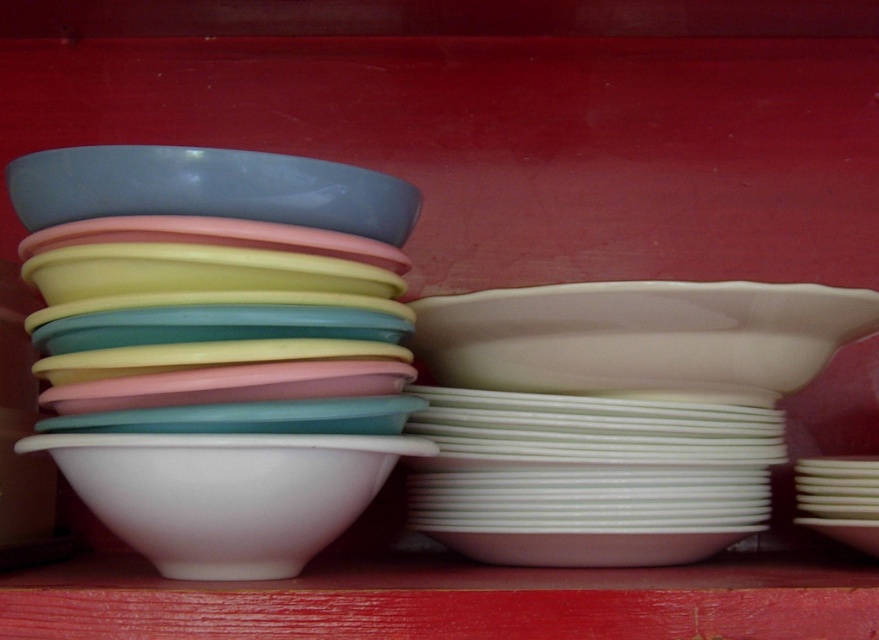
You are organizing dishes on a shelf and see the white glossy bowl at right and the white glossy bowl at center. Which bowl is closer to you?

The white glossy bowl at right is closer to you because the white glossy bowl at center is behind it.

You are a delivery person standing in front of the red wooden shelf. You need to place a new item that is 30 inches long on the shelf. Can you fit it between the white glossy bowl at right and the edge of the shelf?

The white glossy bowl at right is 31.10 inches away from the viewer. Since the item is only 30 inches long, it should fit between the white glossy bowl at right and the edge of the shelf as there is enough space.